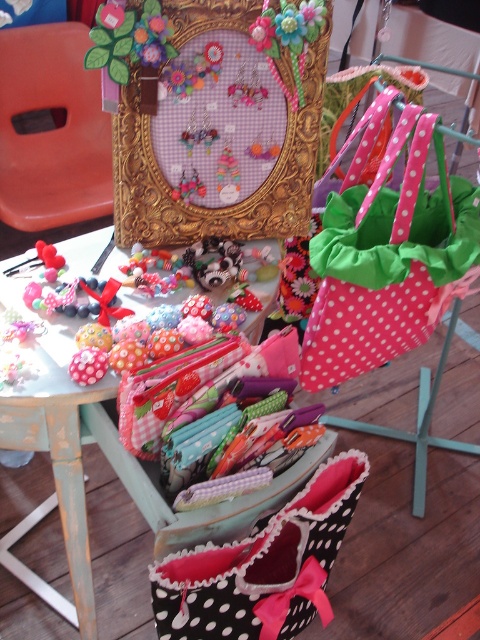
You need to place a large handmade quilt on the wooden table at center. Given that the smooth orange chair at upper left is nearby, will the quilt fit on the table without hanging over the edges?

The wooden table at center has a larger size compared to smooth orange chair at upper left. Since the table is bigger, the quilt should fit without overhanging, assuming the chair doesn not block the space.

You are standing in front of the craft display and want to pick up both items located at point (224, 211) and point (312, 566). Which item should you reach for first to ensure you can grab both without moving your position?

You should reach for the item at point (224, 211) first because it is closer to you than the item at point (312, 566). After picking up the closer one, you can then extend your arm to reach the farther one.

You are at a craft fair and want to place both the goldmetallicpicture frame at upper center and the black polka dot fabric gift bag at center on a shelf. The shelf has a height limit of 15 cm. Can both items fit vertically without exceeding the height limit?

The goldmetallicpicture frame at upper center is taller than the black polka dot fabric gift bag at center. Since the shelf has a 15 cm height limit, we need to know the exact heights of both items to determine if they fit. However, the description only states their relative sizes, not specific measurements. Therefore, it is uncertain if both can fit without exceeding the limit.